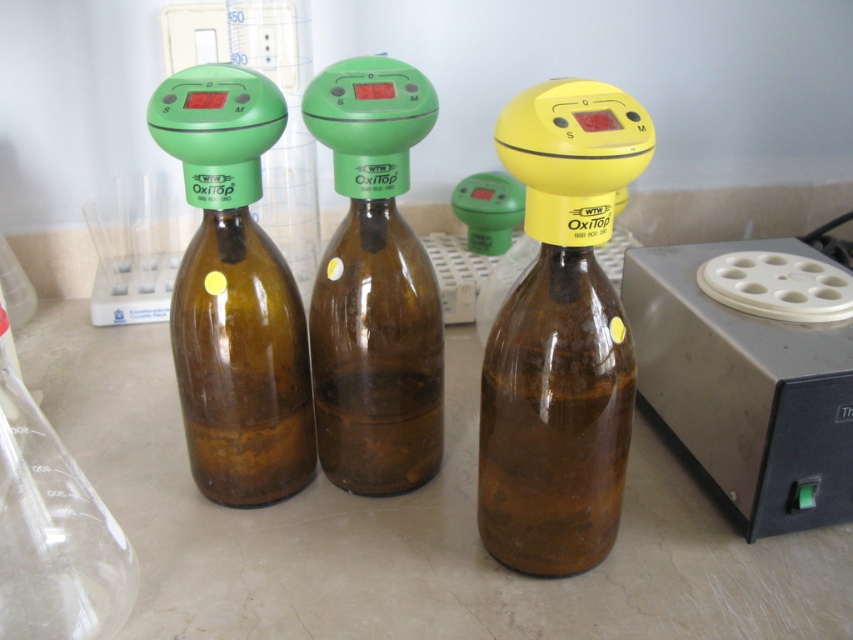
Question: Which point is closer to the camera?

Choices:
 (A) gray plastic centrifuge at right
 (B) yellow matte bottle at center

Answer: (B)

Question: Can you confirm if gray plastic centrifuge at right is thinner than brown glass bottle at center?

Choices:
 (A) yes
 (B) no

Answer: (B)

Question: Which of the following is the closest to the observer?

Choices:
 (A) yellow matte bottle at center
 (B) green matte bottle at center

Answer: (A)

Question: Can you confirm if yellow matte bottle at center is thinner than green matte bottle at center?

Choices:
 (A) no
 (B) yes

Answer: (B)

Question: From the image, what is the correct spatial relationship of gray plastic centrifuge at right in relation to green matte bottle at center?

Choices:
 (A) left
 (B) right

Answer: (B)

Question: Based on their relative distances, which object is farther from the gray plastic centrifuge at right?

Choices:
 (A) green matte bottle at center
 (B) yellow matte bottle at center
 (C) brown glass bottle at center

Answer: (C)